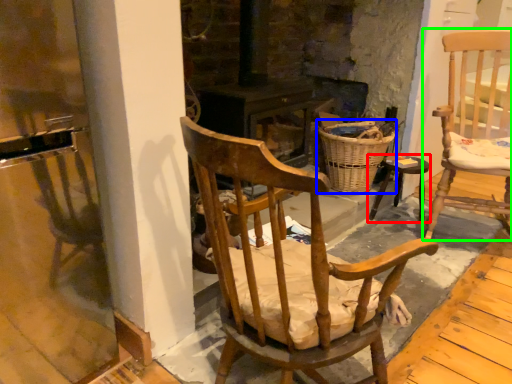
Question: Considering the real-world distances, which object is farthest from stool (highlighted by a red box)? basket (highlighted by a blue box) or chair (highlighted by a green box)?

Choices:
 (A) basket
 (B) chair

Answer: (B)